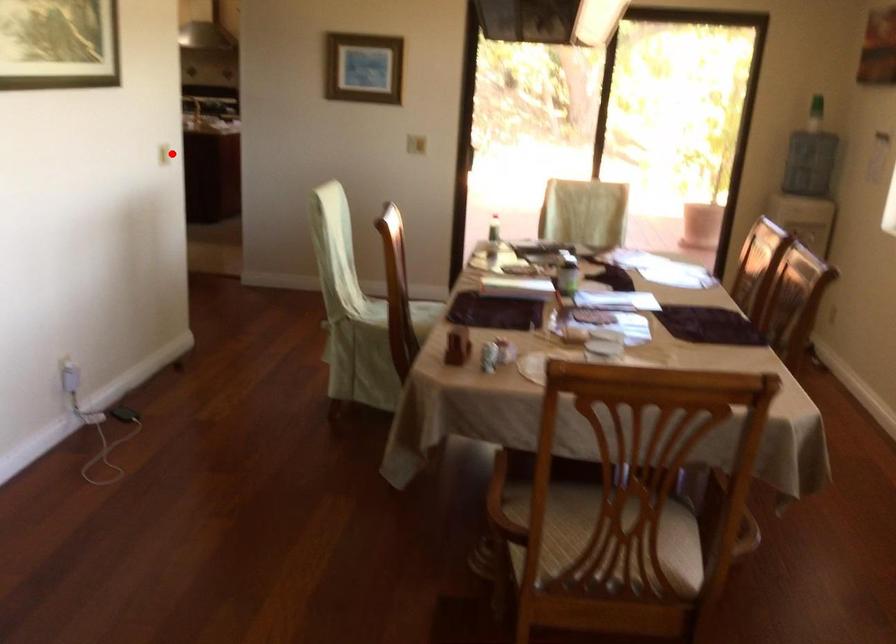
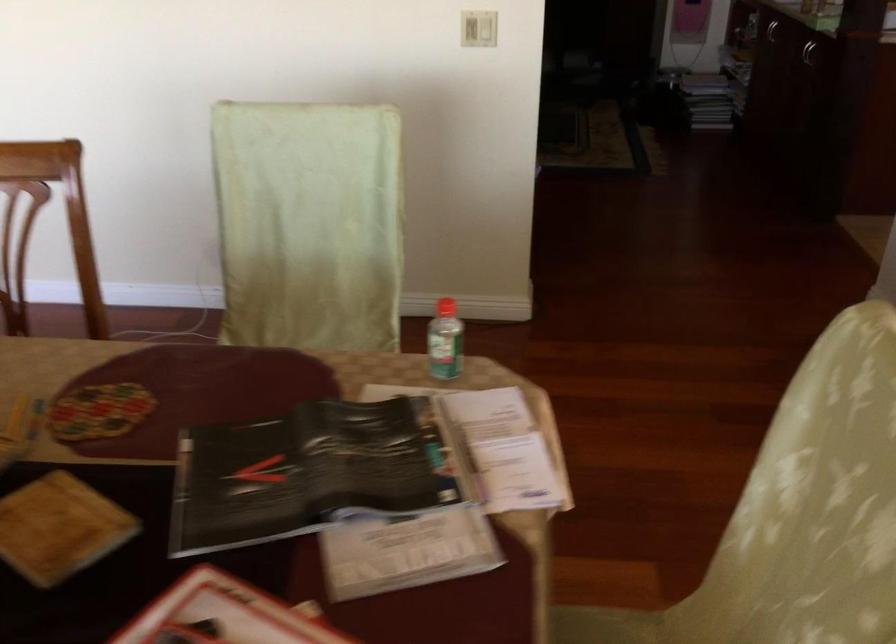
In the second image, find the point that corresponds to the highlighted location in the first image.

(478, 29)